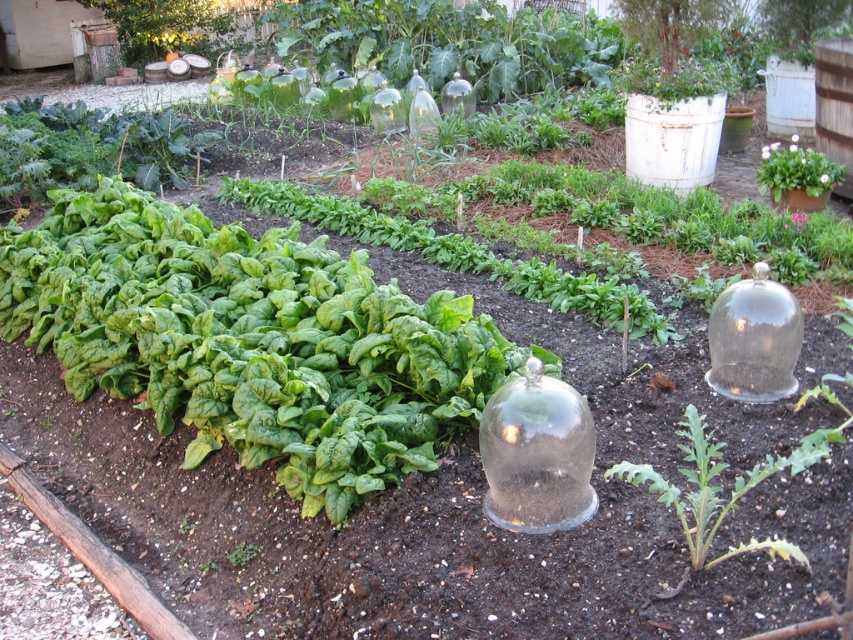
Between point (689, 468) and point (809, 186), which one is positioned in front?

Point (689, 468)

Is green leafy at lower right further to camera compared to white matte flower pot at upper right?

No, it is in front of white matte flower pot at upper right.

Between point (728, 554) and point (822, 193), which one is positioned behind?

The point (822, 193) is behind.

Locate an element on the screen. Image resolution: width=853 pixels, height=640 pixels. green leafy at lower right is located at coordinates coord(721,486).

From the picture: Is green leafy spinach at left taller than green leafy at lower right?

Indeed, green leafy spinach at left has a greater height compared to green leafy at lower right.

Can you confirm if green leafy spinach at left is shorter than green leafy at lower right?

Incorrect, green leafy spinach at left's height does not fall short of green leafy at lower right's.

At what (x,y) coordinates should I click in order to perform the action: click on green leafy spinach at left. Please return your answer as a coordinate pair (x, y). Image resolution: width=853 pixels, height=640 pixels. Looking at the image, I should click on (250, 339).

Between point (308, 352) and point (791, 184), which one is positioned in front?

Positioned in front is point (308, 352).

Between green leafy spinach at left and white matte flower pot at upper right, which one is positioned lower?

Positioned lower is green leafy spinach at left.

Locate an element on the screen. This screenshot has width=853, height=640. green leafy spinach at left is located at coordinates (250, 339).

The height and width of the screenshot is (640, 853). Identify the location of green leafy spinach at left. (250, 339).